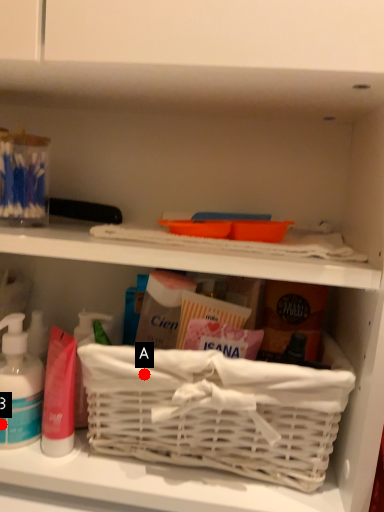
Question: Two points are circled on the image, labeled by A and B beside each circle. Among these points, which one is farthest from the camera?

Choices:
 (A) A is further
 (B) B is further

Answer: (B)